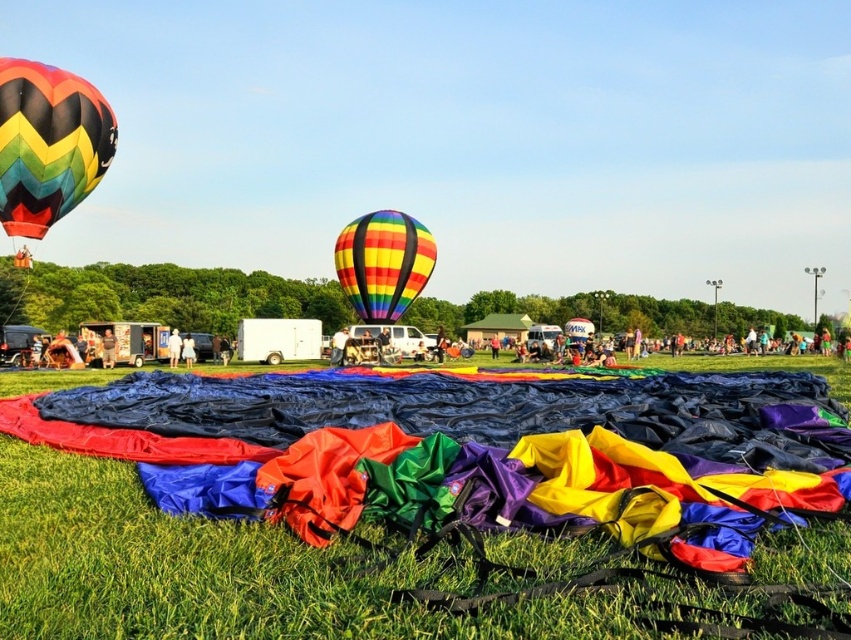
Identify the location of green grass at lower center. The height and width of the screenshot is (640, 851). (204, 572).

Can you confirm if green grass at lower center is positioned below rainbow striped hot air balloon at upper left?

Correct, green grass at lower center is located below rainbow striped hot air balloon at upper left.

This screenshot has width=851, height=640. Find the location of `green grass at lower center`. green grass at lower center is located at coordinates (204, 572).

Locate an element on the screen. green grass at lower center is located at coordinates (204, 572).

Is rainbow striped hot air balloon at upper left above rainbow striped balloon at center?

Correct, rainbow striped hot air balloon at upper left is located above rainbow striped balloon at center.

Does rainbow striped hot air balloon at upper left lie behind rainbow striped balloon at center?

No, it is not.

Which is behind, point (36, 90) or point (418, 250)?

Positioned behind is point (418, 250).

Image resolution: width=851 pixels, height=640 pixels. I want to click on rainbow striped hot air balloon at upper left, so click(49, 144).

Is point (58, 456) closer to viewer compared to point (407, 243)?

Yes, point (58, 456) is in front of point (407, 243).

Can you confirm if green grass at lower center is bigger than rainbow striped balloon at center?

Correct, green grass at lower center is larger in size than rainbow striped balloon at center.

At what (x,y) coordinates should I click in order to perform the action: click on green grass at lower center. Please return your answer as a coordinate pair (x, y). This screenshot has height=640, width=851. Looking at the image, I should click on pyautogui.click(x=204, y=572).

The image size is (851, 640). Find the location of `green grass at lower center`. green grass at lower center is located at coordinates (204, 572).